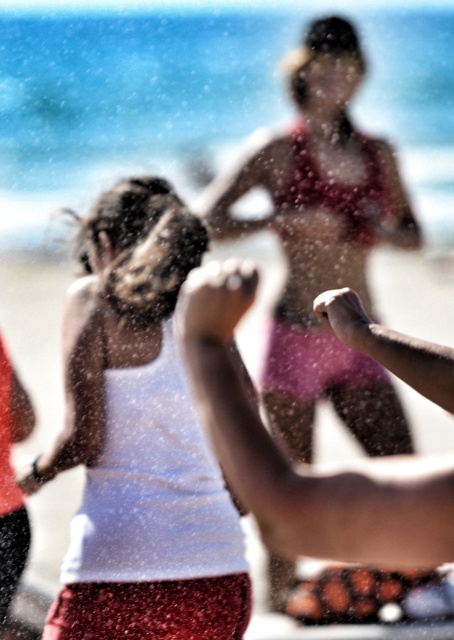
You are standing at the origin point in the beach scene. There are two points marked in the image, one at coordinate point [182,67] and the other at point [164,595]. If you want to walk towards the point that is closer to the background, which coordinate should you head towards?

You should head towards point [182,67] because it is behind point [164,595], making it closer to the background.

You are a photographer trying to capture the perfect shot of the clear water at center and the white matte tank top at center. Based on their positions, which object should you focus on first to ensure both are in sharp focus?

The clear water at center is above the white matte tank top at center, so you should focus on the white matte tank top at center first since it is closer to the camera. This way, when adjusting the focus, the clear water at center will naturally come into focus afterward as it is positioned above.

What are the coordinates of the white matte tank top at center?

The white matte tank top at center is located at point [139,440].